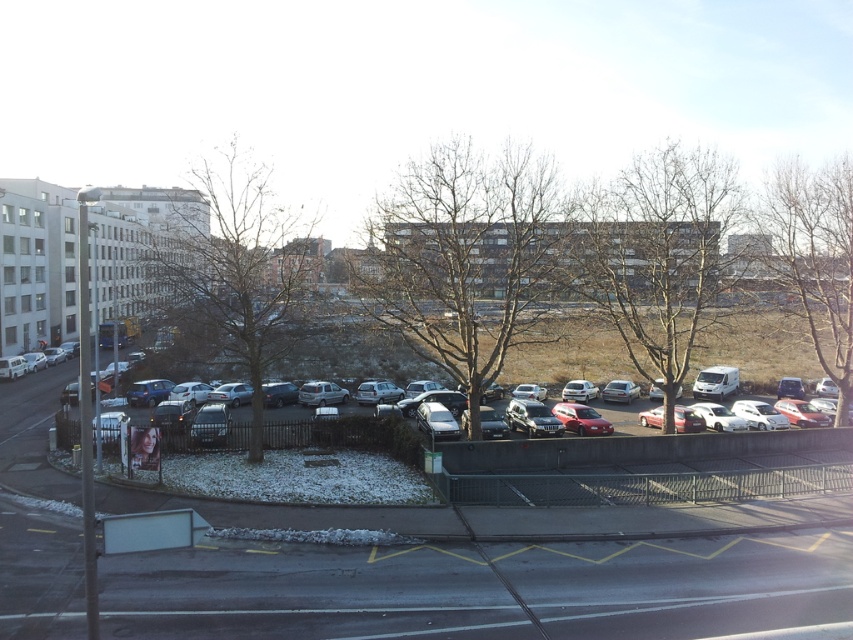
Who is shorter, white matte parking lot at center or satin silver car at center?

satin silver car at center is shorter.

Does white matte parking lot at center have a lesser width compared to satin silver car at center?

No.

What are the coordinates of `white matte parking lot at center` in the screenshot? It's located at (480, 576).

From the picture: Can you confirm if satin silver car at center is positioned to the left of satin silver suv at center?

No, satin silver car at center is not to the left of satin silver suv at center.

Who is positioned more to the right, satin silver car at center or satin silver suv at center?

satin silver car at center is more to the right.

Is point (532, 413) closer to camera compared to point (309, 381)?

Yes, point (532, 413) is in front of point (309, 381).

The height and width of the screenshot is (640, 853). Find the location of `satin silver car at center`. satin silver car at center is located at coordinates (532, 419).

Is white matte parking lot at center taller than satin silver sedan at center?

Indeed, white matte parking lot at center has a greater height compared to satin silver sedan at center.

Is point (578, 541) farther from camera compared to point (570, 392)?

No, (578, 541) is closer to viewer.

At what (x,y) coordinates should I click in order to perform the action: click on white matte parking lot at center. Please return your answer as a coordinate pair (x, y). The width and height of the screenshot is (853, 640). Looking at the image, I should click on (480, 576).